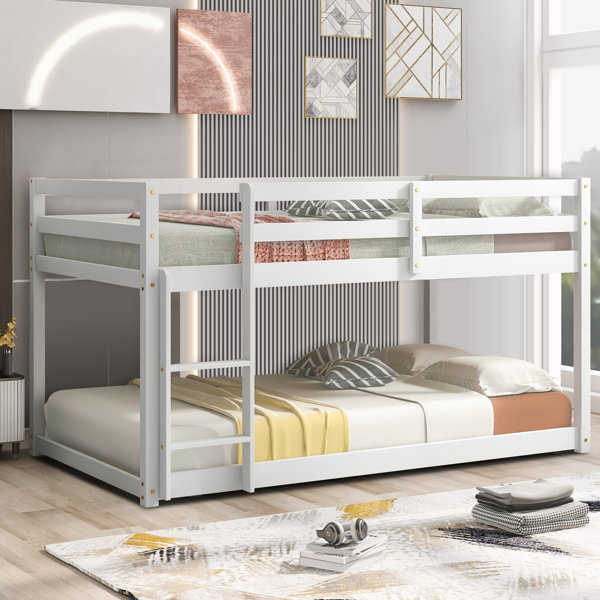
Find the location of `white walls`. white walls is located at coordinates (492, 118), (77, 136).